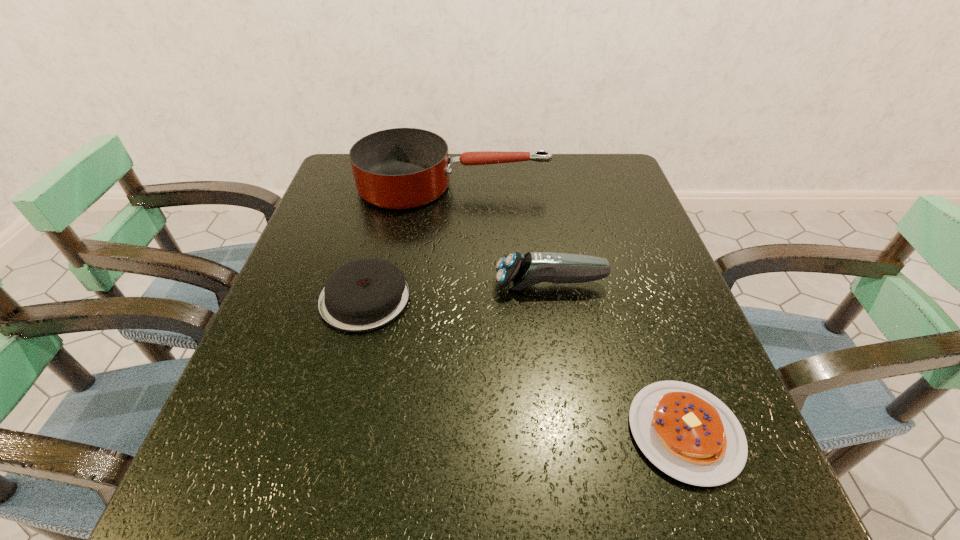
Image resolution: width=960 pixels, height=540 pixels. Identify the location of vacant space that's between the third shortest object and the right pancake. (617, 358).

Image resolution: width=960 pixels, height=540 pixels. Identify the location of vacant space that's between the farthest object and the nearest object. (569, 309).

Where is `empty location between the nearer pancake and the farthest object`? Image resolution: width=960 pixels, height=540 pixels. empty location between the nearer pancake and the farthest object is located at coordinates [x=569, y=309].

At what (x,y) coordinates should I click in order to perform the action: click on vacant region between the electric shaver and the farther pancake. Please return your answer as a coordinate pair (x, y). The width and height of the screenshot is (960, 540). Looking at the image, I should click on (458, 291).

Where is `free space between the electric shaver and the nearest object`? This screenshot has width=960, height=540. free space between the electric shaver and the nearest object is located at coordinates (617, 358).

Locate an element on the screen. This screenshot has height=540, width=960. free space that is in between the pan and the left pancake is located at coordinates (409, 242).

This screenshot has height=540, width=960. Identify the location of object that is the second closest one to the left pancake. (401, 168).

Select which object appears as the third closest to the farthest object. Please provide its 2D coordinates. Your answer should be formatted as a tuple, i.e. [(x, y)], where the tuple contains the x and y coordinates of a point satisfying the conditions above.

[(688, 433)]

At what (x,y) coordinates should I click in order to perform the action: click on vacant space that satisfies the following two spatial constraints: 1. on the head of the electric shaver; 2. on the left side of the shortest object. Please return your answer as a coordinate pair (x, y). The width and height of the screenshot is (960, 540). Looking at the image, I should click on (574, 432).

Where is `vacant region that satisfies the following two spatial constraints: 1. on the front side of the farther pancake; 2. on the left side of the nearest object`? Image resolution: width=960 pixels, height=540 pixels. vacant region that satisfies the following two spatial constraints: 1. on the front side of the farther pancake; 2. on the left side of the nearest object is located at coordinates (330, 432).